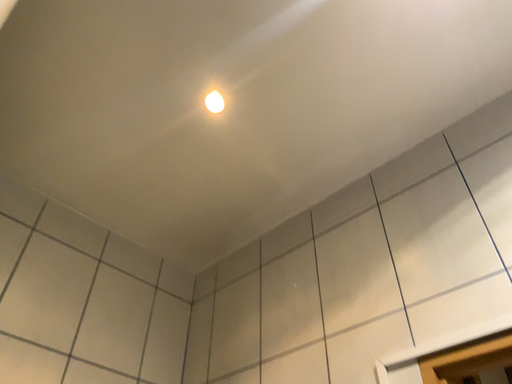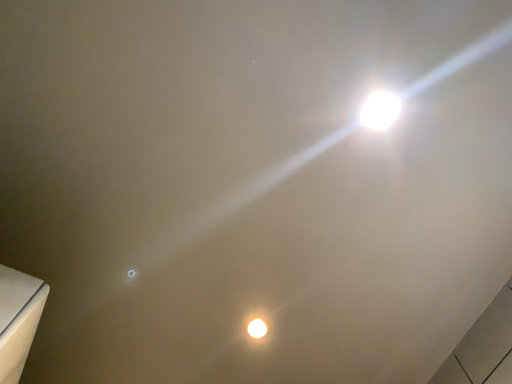
Question: How did the camera likely rotate when shooting the video?

Choices:
 (A) rotated upward
 (B) rotated downward

Answer: (A)